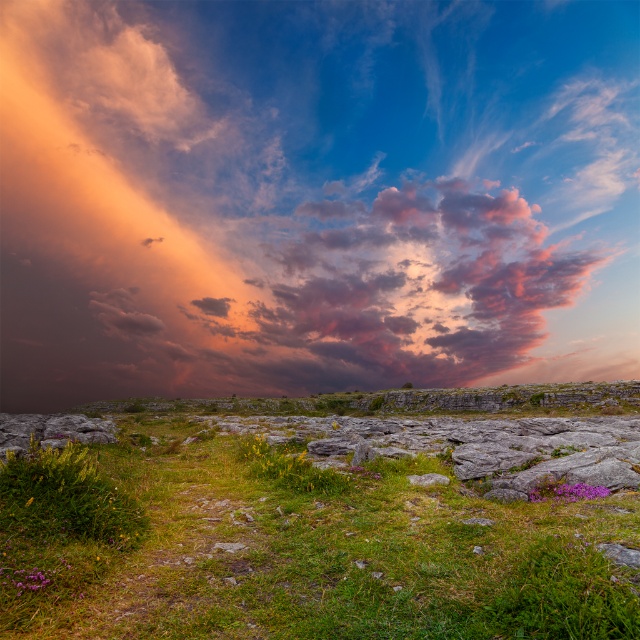
Can you confirm if orange-pink cotton clouds at upper center is bigger than purple matte flower at lower right?

Yes.

I want to click on orange-pink cotton clouds at upper center, so click(x=314, y=195).

Is green grassy at lower center in front of purple matte flower at lower right?

Yes.

Does green grassy at lower center have a larger size compared to purple matte flower at lower right?

Indeed, green grassy at lower center has a larger size compared to purple matte flower at lower right.

The image size is (640, 640). Identify the location of green grassy at lower center. (321, 554).

The width and height of the screenshot is (640, 640). In order to click on green grassy at lower center in this screenshot , I will do `click(321, 554)`.

In the scene shown: Who is more distant from viewer, (456, 188) or (211, 580)?

Positioned behind is point (456, 188).

Where is `orange-pink cotton clouds at upper center`? The width and height of the screenshot is (640, 640). orange-pink cotton clouds at upper center is located at coordinates (314, 195).

The image size is (640, 640). In order to click on orange-pink cotton clouds at upper center in this screenshot , I will do `click(314, 195)`.